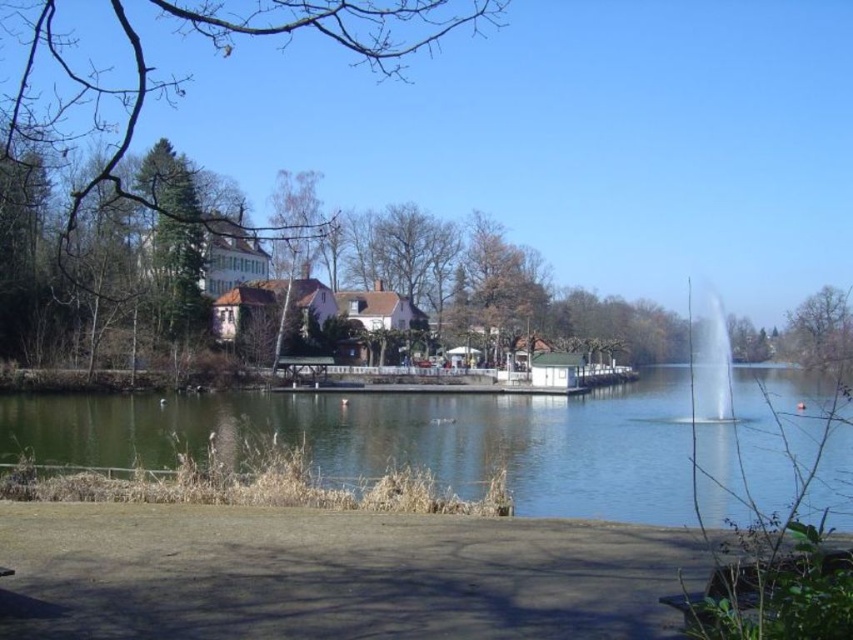
Does wooden park bench at lower right have a smaller size compared to clear glass fountain at center?

Correct, wooden park bench at lower right occupies less space than clear glass fountain at center.

Who is shorter, wooden park bench at lower right or clear glass fountain at center?

Standing shorter between the two is wooden park bench at lower right.

Image resolution: width=853 pixels, height=640 pixels. Identify the location of wooden park bench at lower right. (775, 600).

Who is higher up, bare wood tree at center or clear glass fountain at center?

bare wood tree at center is above.

Is the position of bare wood tree at center less distant than that of clear glass fountain at center?

No, it is not.

Identify the location of bare wood tree at center. This screenshot has height=640, width=853. (294, 237).

Locate an element on the screen. bare wood tree at center is located at coordinates (294, 237).

Who is more forward, [300,189] or [834,353]?

Point [300,189] is in front.

Can you confirm if bare wood tree at center is positioned to the right of bare branches at upper right?

In fact, bare wood tree at center is to the left of bare branches at upper right.

Find the location of a particular element. The width and height of the screenshot is (853, 640). bare wood tree at center is located at coordinates (294, 237).